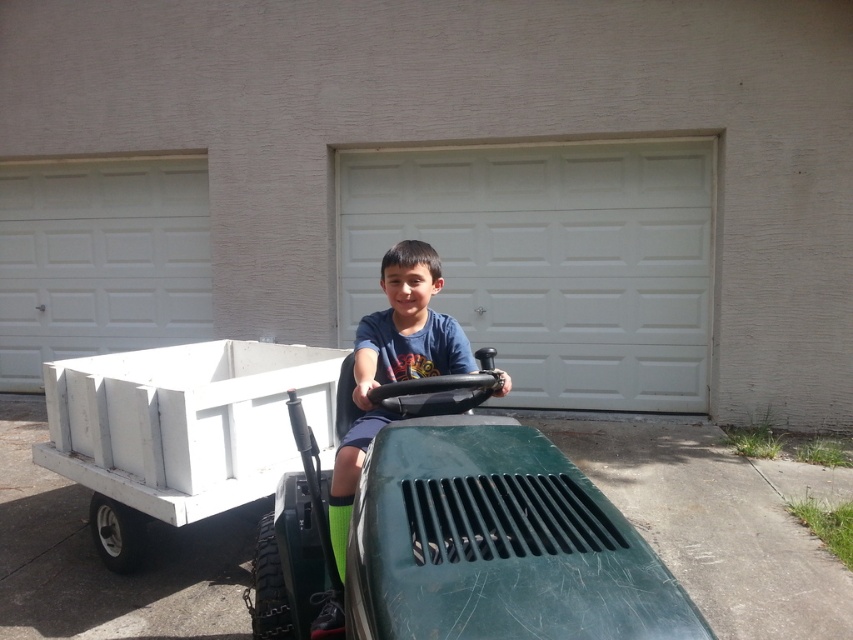
How much distance is there between white textured garage door at center and white textured garage door at left?

white textured garage door at center and white textured garage door at left are 9.32 feet apart from each other.

At what (x,y) coordinates should I click in order to perform the action: click on white textured garage door at center. Please return your answer as a coordinate pair (x, y). This screenshot has height=640, width=853. Looking at the image, I should click on (550, 260).

Which is more to the left, white textured garage door at center or green matte lawn mower at center?

From the viewer's perspective, green matte lawn mower at center appears more on the left side.

Is white textured garage door at center to the right of green matte lawn mower at center from the viewer's perspective?

Indeed, white textured garage door at center is positioned on the right side of green matte lawn mower at center.

Who is more distant from viewer, (508, 282) or (448, 557)?

The point (508, 282) is more distant.

Where is `white textured garage door at center`? The height and width of the screenshot is (640, 853). white textured garage door at center is located at coordinates (550, 260).

Is point (514, 289) more distant than point (265, 344)?

Yes, it is.

This screenshot has width=853, height=640. Describe the element at coordinates (550, 260) in the screenshot. I see `white textured garage door at center` at that location.

Locate an element on the screen. The height and width of the screenshot is (640, 853). white textured garage door at center is located at coordinates (550, 260).